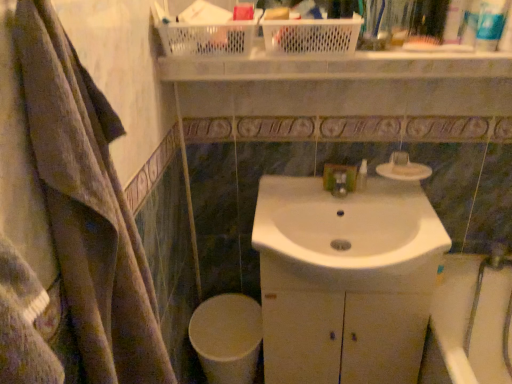
Locate an element on the screen. Image resolution: width=512 pixels, height=384 pixels. blank space to the left of green matte soap dispenser at center, which is the first toiletry from bottom to top is located at coordinates (314, 197).